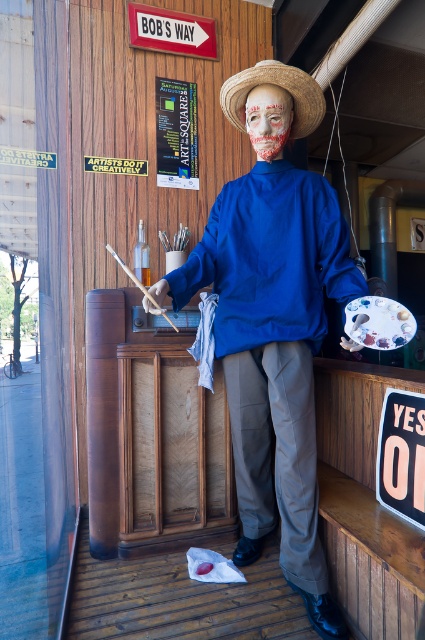
Question: Which point appears closest to the camera in this image?

Choices:
 (A) (277, 86)
 (B) (255, 522)

Answer: (A)

Question: Is matte blue shirt at center bigger than blood-stained fabric mask at center?

Choices:
 (A) yes
 (B) no

Answer: (A)

Question: Is matte blue shirt at center above strawhat at center?

Choices:
 (A) yes
 (B) no

Answer: (B)

Question: Is matte blue shirt at center smaller than strawhat at center?

Choices:
 (A) yes
 (B) no

Answer: (B)

Question: Which is farther from the matte blue shirt at center?

Choices:
 (A) blood-stained fabric mask at center
 (B) strawhat at center

Answer: (B)

Question: Based on their relative distances, which object is nearer to the matte blue shirt at center?

Choices:
 (A) strawhat at center
 (B) blood-stained fabric mask at center

Answer: (B)